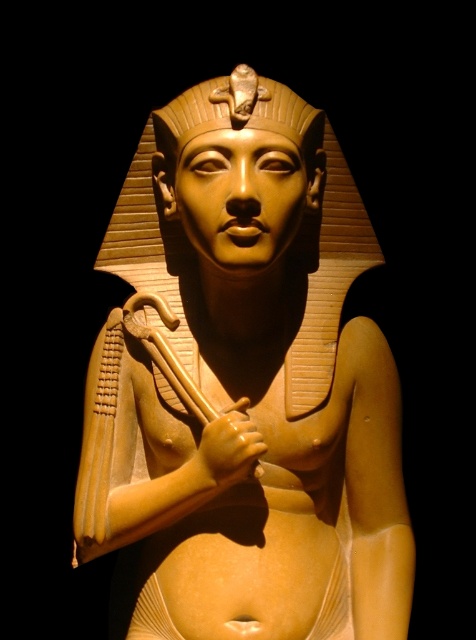
What are the coordinates of `matte gold statue at center` in the screenshot? It's located at (247, 385).

Between matte gold statue at center and matte gold pharaoh head at center, which one appears on the right side from the viewer's perspective?

matte gold pharaoh head at center

The width and height of the screenshot is (476, 640). What do you see at coordinates (247, 385) in the screenshot?
I see `matte gold statue at center` at bounding box center [247, 385].

Locate an element on the screen. This screenshot has height=640, width=476. matte gold statue at center is located at coordinates coord(247,385).